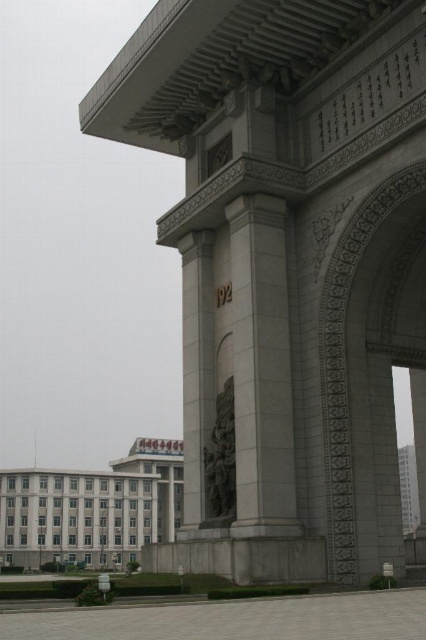
You are a tourist standing in front of the archway and want to take a photo of the white concrete building at lower left and the dark gray stone statue at center. From your current position, which object is closer to you?

The white concrete building at lower left is closer to you because it is positioned under the dark gray stone statue at center, indicating it is in a lower, nearer position.

You are standing in front of the monumental archway and want to locate the white stone column at center. According to the coordinates provided, where exactly would you find it?

The white stone column at center is located at coordinates point (261, 369).

You are standing in front of the monumental archway and notice two points marked on the column. The first point is at coordinates point (253, 417) and the second is at point (221, 452). Which of these two points is nearer to your current position?

Point (253, 417) is closer to the viewer than point (221, 452).